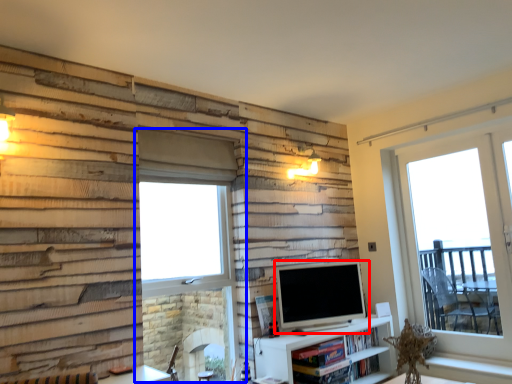
Question: Which object is further to the camera taking this photo, television (highlighted by a red box) or window (highlighted by a blue box)?

Choices:
 (A) television
 (B) window

Answer: (A)